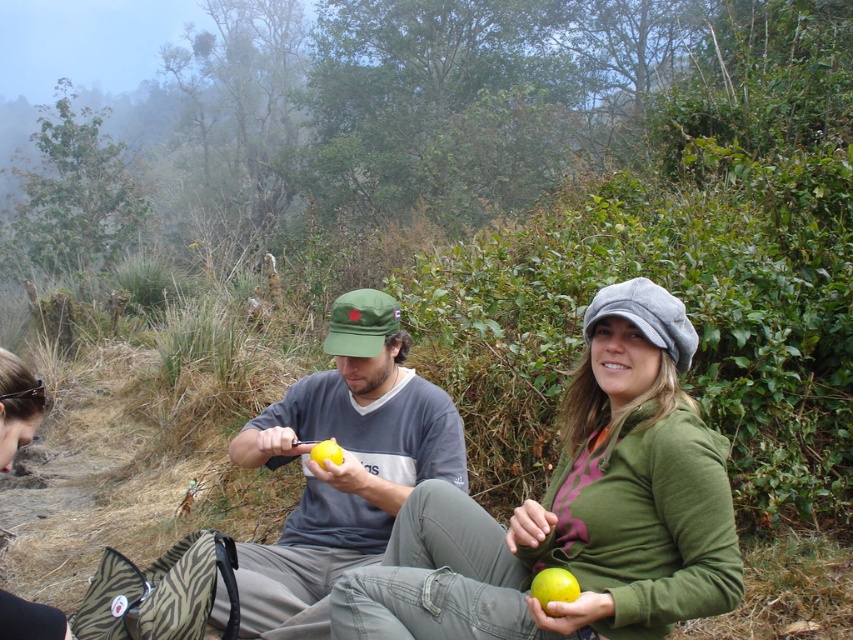
Is point (289, 440) farther from camera compared to point (543, 596)?

Yes, point (289, 440) is farther from viewer.

Is point (340, 381) less distant than point (560, 570)?

No, (340, 381) is further to viewer.

Find the location of a particular element. The height and width of the screenshot is (640, 853). matte gray cap at center is located at coordinates (341, 465).

Is matte green sweater at center thinner than matte gray cap at center?

No.

What do you see at coordinates (576, 509) in the screenshot?
I see `matte green sweater at center` at bounding box center [576, 509].

Find the location of a particular element. The height and width of the screenshot is (640, 853). matte green sweater at center is located at coordinates (576, 509).

Is matte black hair at lower left smaller than yellow matte apple at lower center?

No, matte black hair at lower left is not smaller than yellow matte apple at lower center.

Does matte black hair at lower left have a larger size compared to yellow matte apple at lower center?

Correct, matte black hair at lower left is larger in size than yellow matte apple at lower center.

What do you see at coordinates (16, 406) in the screenshot? I see `matte black hair at lower left` at bounding box center [16, 406].

Identify the location of matte black hair at lower left. [x=16, y=406].